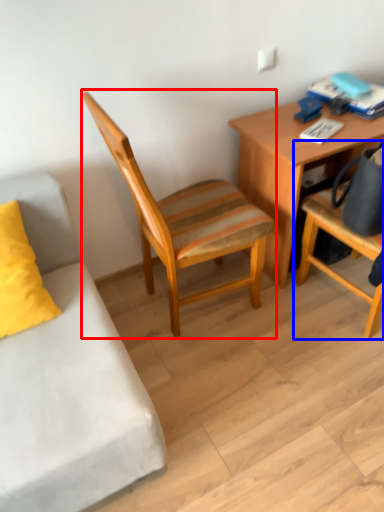
Question: Which object appears farthest to the camera in this image, chair (highlighted by a red box) or chair (highlighted by a blue box)?

Choices:
 (A) chair
 (B) chair

Answer: (A)